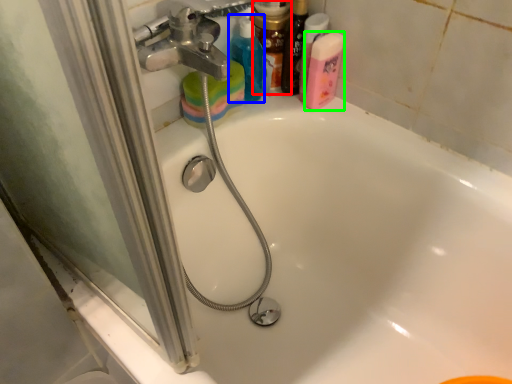
Question: Estimate the real-world distances between objects in this image. Which object is farther from toiletry (highlighted by a red box), cleaning product (highlighted by a blue box) or cleaning product (highlighted by a green box)?

Choices:
 (A) cleaning product
 (B) cleaning product

Answer: (B)